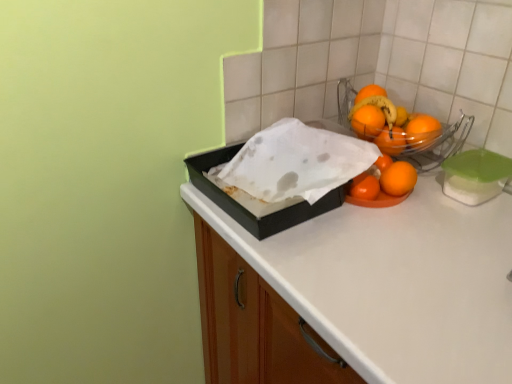
Question: Can you confirm if shiny orange oranges at upper right is shorter than black matte box at center?

Choices:
 (A) yes
 (B) no

Answer: (B)

Question: Is shiny orange oranges at upper right wider than black matte box at center?

Choices:
 (A) no
 (B) yes

Answer: (A)

Question: Is shiny orange oranges at upper right positioned in front of black matte box at center?

Choices:
 (A) no
 (B) yes

Answer: (A)

Question: Considering the relative positions of shiny orange oranges at upper right and black matte box at center in the image provided, is shiny orange oranges at upper right to the right of black matte box at center from the viewer's perspective?

Choices:
 (A) no
 (B) yes

Answer: (B)

Question: Would you say shiny orange oranges at upper right contains black matte box at center?

Choices:
 (A) no
 (B) yes

Answer: (A)

Question: Is orange matte at upper right, the 4th orange positioned from the bottom, to the left or to the right of shiny orange oranges at upper right in the image?

Choices:
 (A) right
 (B) left

Answer: (B)

Question: Based on their sizes in the image, would you say orange matte at upper right, arranged as the first orange when viewed from the top, is bigger or smaller than shiny orange oranges at upper right?

Choices:
 (A) big
 (B) small

Answer: (B)

Question: From the image's perspective, is orange matte at upper right, the 4th orange positioned from the bottom, located above or below shiny orange oranges at upper right?

Choices:
 (A) below
 (B) above

Answer: (A)

Question: From a real-world perspective, is orange matte at upper right, arranged as the first orange when viewed from the top, positioned above or below shiny orange oranges at upper right?

Choices:
 (A) below
 (B) above

Answer: (A)

Question: From their relative heights in the image, would you say orange matte at right, marked as the second orange in a top-to-bottom arrangement, is taller or shorter than black matte box at center?

Choices:
 (A) short
 (B) tall

Answer: (A)

Question: Considering the positions of orange matte at right, marked as the second orange in a top-to-bottom arrangement, and black matte box at center in the image, is orange matte at right, marked as the second orange in a top-to-bottom arrangement, bigger or smaller than black matte box at center?

Choices:
 (A) small
 (B) big

Answer: (A)

Question: From the image's perspective, relative to black matte box at center, is orange matte at right, marked as the second orange in a top-to-bottom arrangement, above or below?

Choices:
 (A) above
 (B) below

Answer: (A)

Question: From a real-world perspective, is orange matte at right, marked as the second orange in a top-to-bottom arrangement, positioned above or below black matte box at center?

Choices:
 (A) below
 (B) above

Answer: (B)

Question: From a real-world perspective, is orange matte/orange at center, the 1th orange from the bottom, positioned above or below orange matte at upper right, arranged as the first orange when viewed from the top?

Choices:
 (A) below
 (B) above

Answer: (A)

Question: From the image's perspective, is orange matte/orange at center, the 1th orange from the bottom, above or below orange matte at upper right, the 4th orange positioned from the bottom?

Choices:
 (A) above
 (B) below

Answer: (B)